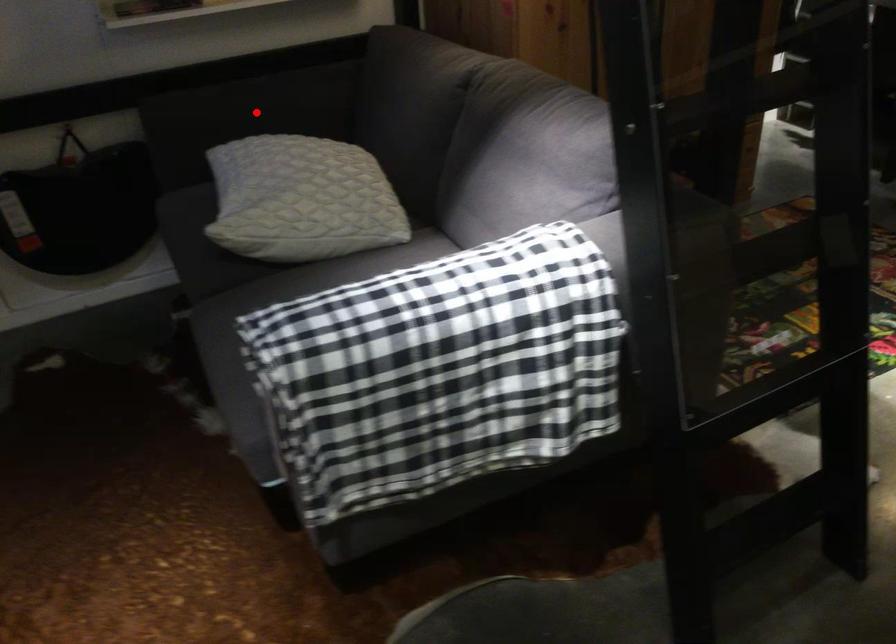
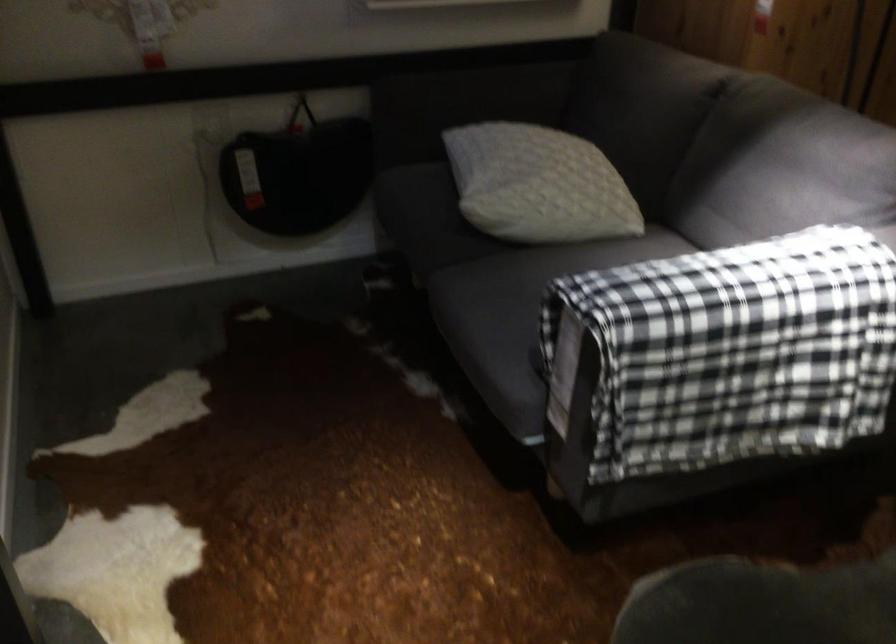
Find the pixel in the second image that matches the highlighted location in the first image.

(478, 98)